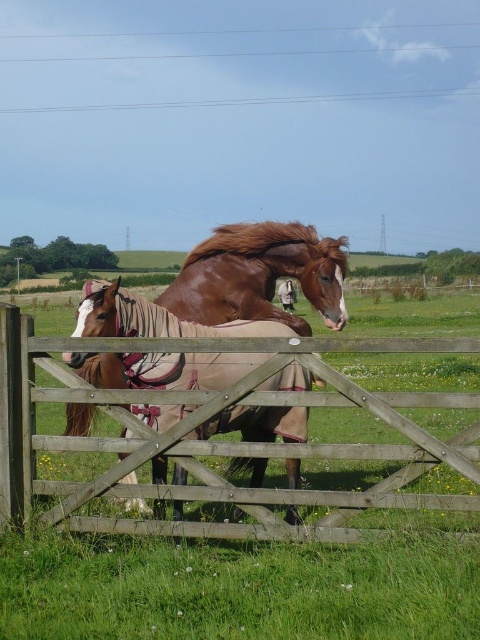
Does wooden gate at center appear on the left side of brown glossy horse at center?

Incorrect, wooden gate at center is not on the left side of brown glossy horse at center.

Can you confirm if wooden gate at center is positioned above brown glossy horse at center?

No.

The width and height of the screenshot is (480, 640). In order to click on wooden gate at center in this screenshot , I will do `click(317, 454)`.